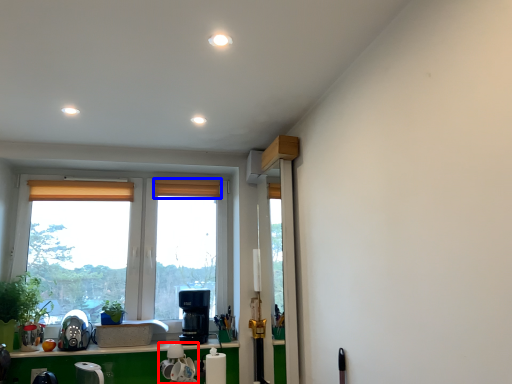
Question: Which object is further to the camera taking this photo, appliance (highlighted by a red box) or curtain (highlighted by a blue box)?

Choices:
 (A) appliance
 (B) curtain

Answer: (B)